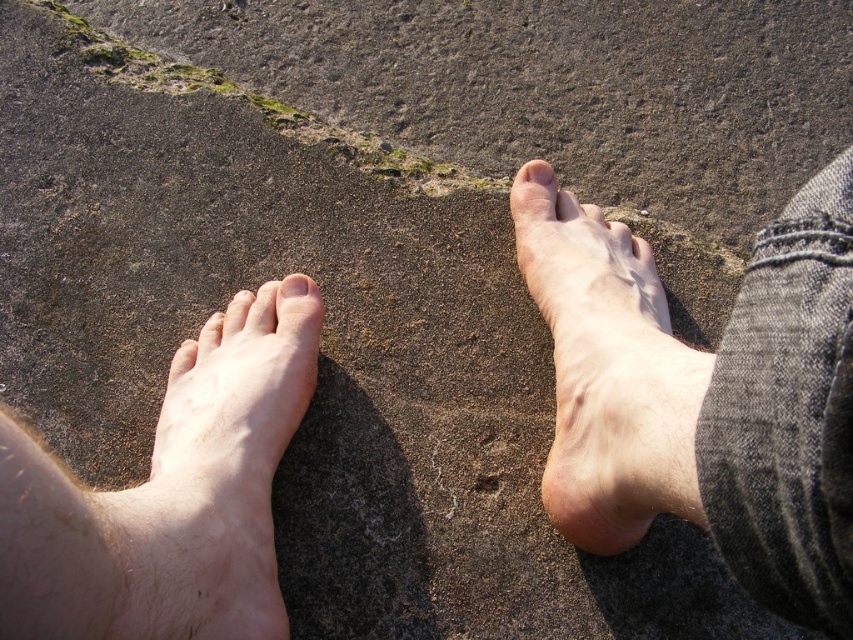
You are designing a custom shoe insert for the skinny barefoot at right and the matte skin toe at upper center. Which object requires a wider insert based on their dimensions?

The skinny barefoot at right requires a wider insert because its width is larger than the matte skin toe at upper center.